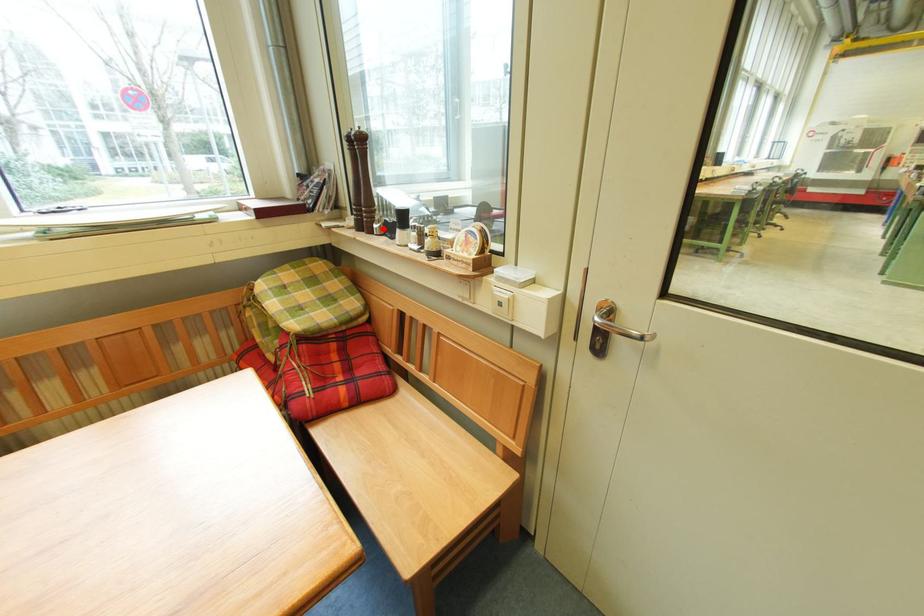
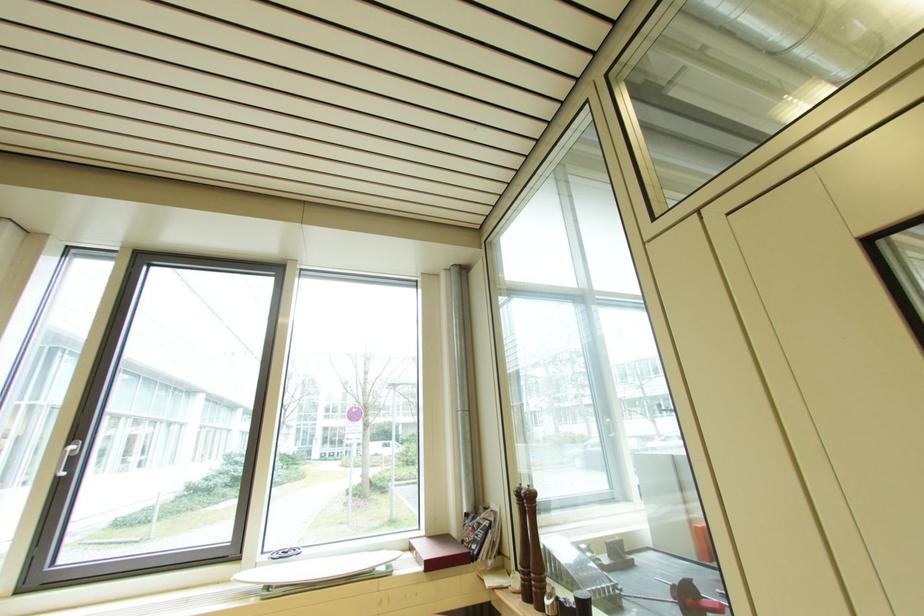
Where in the second image is the point corresponding to the highlighted location from the first image?

(554, 605)